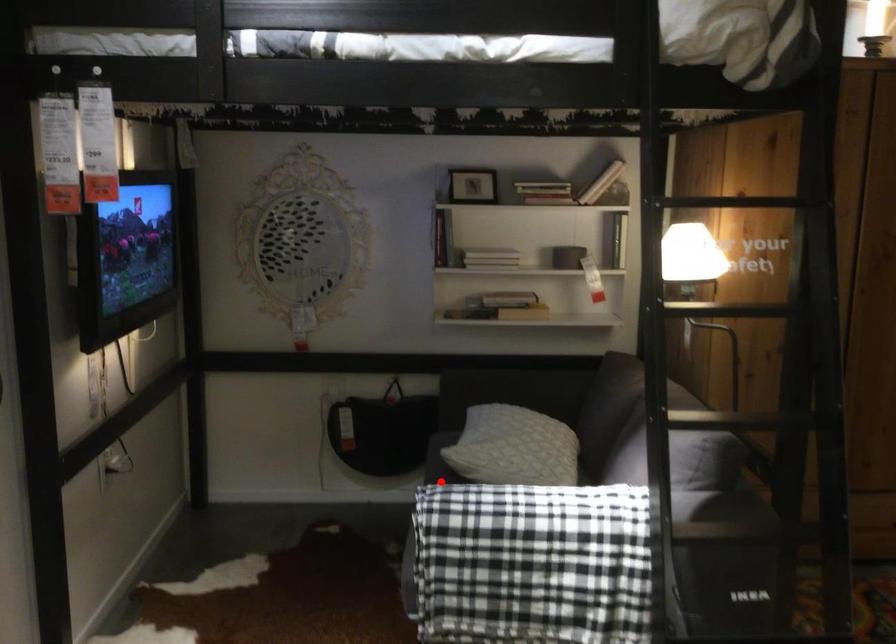
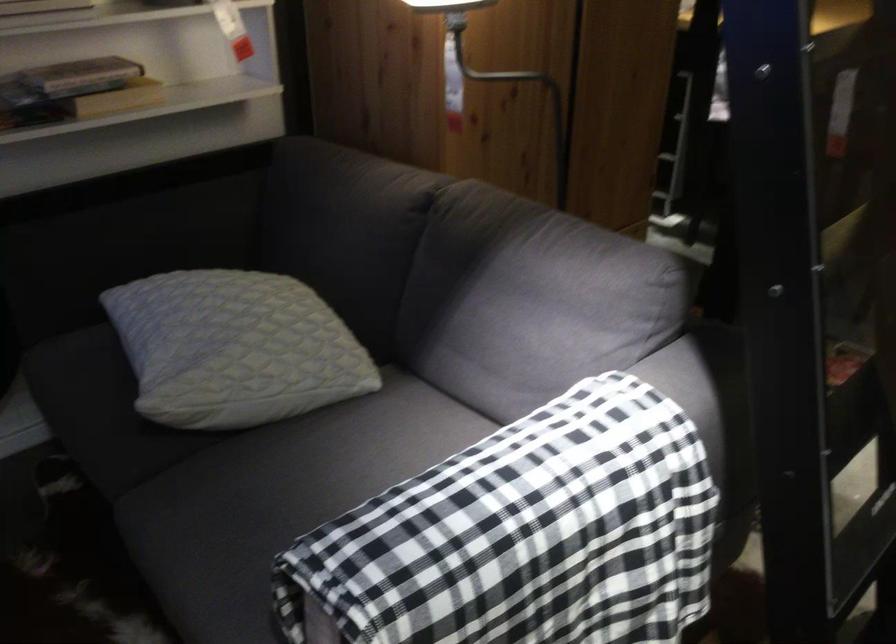
Find the pixel in the second image that matches the highlighted location in the first image.

(131, 448)